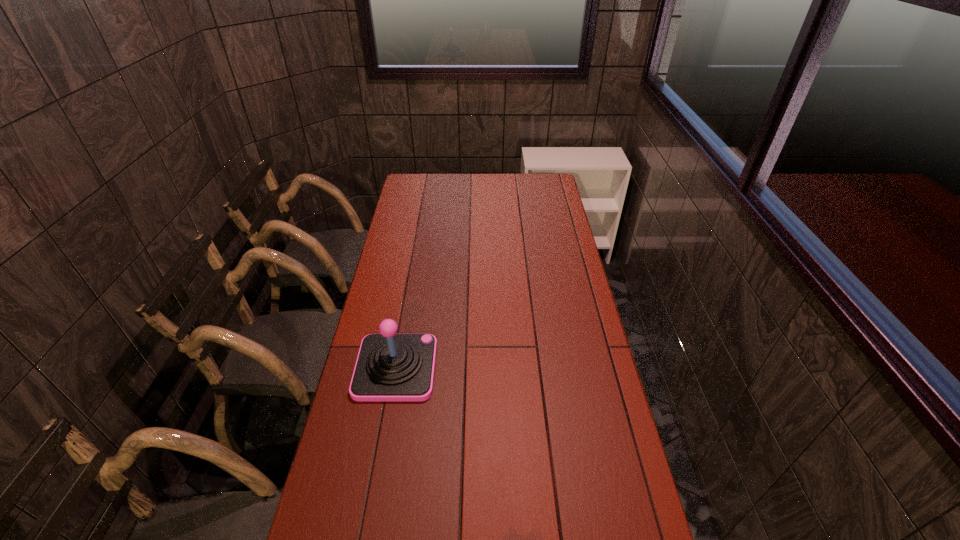
This screenshot has height=540, width=960. I want to click on joystick, so [390, 367].

I want to click on vacant area situated forward from the base of the object, so click(x=516, y=368).

Locate an element on the screen. The height and width of the screenshot is (540, 960). object present at the left edge is located at coordinates (390, 367).

Where is `free region at the far edge of the desktop`? The width and height of the screenshot is (960, 540). free region at the far edge of the desktop is located at coordinates (448, 185).

I want to click on vacant region at the left edge, so click(340, 466).

In the image, there is a desktop. Where is `free space at the right edge`? free space at the right edge is located at coordinates (550, 316).

This screenshot has width=960, height=540. What are the coordinates of `vacant space at the far left corner of the desktop` in the screenshot? It's located at (425, 194).

You are a GUI agent. You are given a task and a screenshot of the screen. Output one action in this format:
    pyautogui.click(x=<x>, y=<y>)
    Task: Click on the vacant position at the far right corner of the desktop
    This screenshot has height=540, width=960.
    Given the screenshot: What is the action you would take?
    pyautogui.click(x=542, y=176)